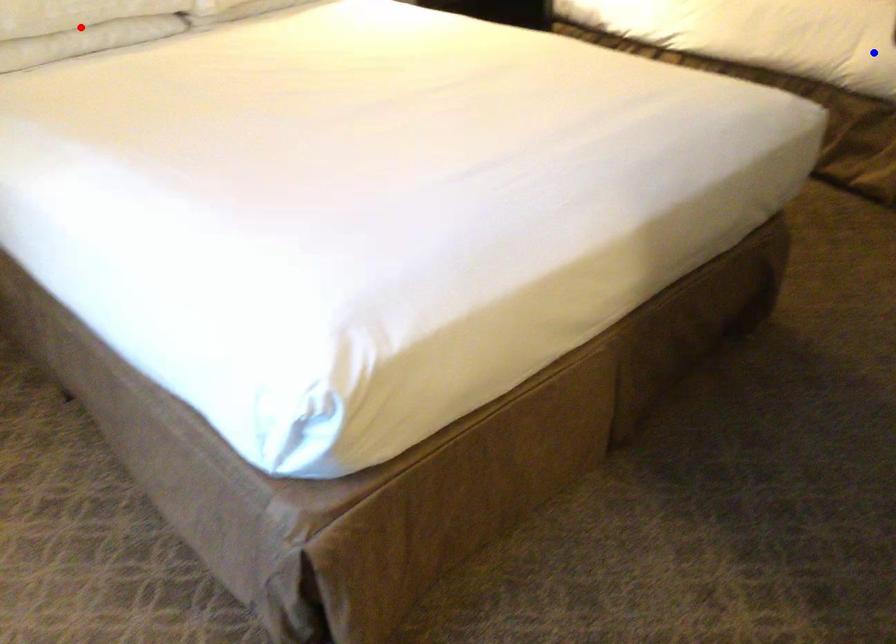
Question: In the image, two points are highlighted. Which point is nearer to the camera? Reply with the corresponding letter.

Choices:
 (A) blue point
 (B) red point

Answer: (B)